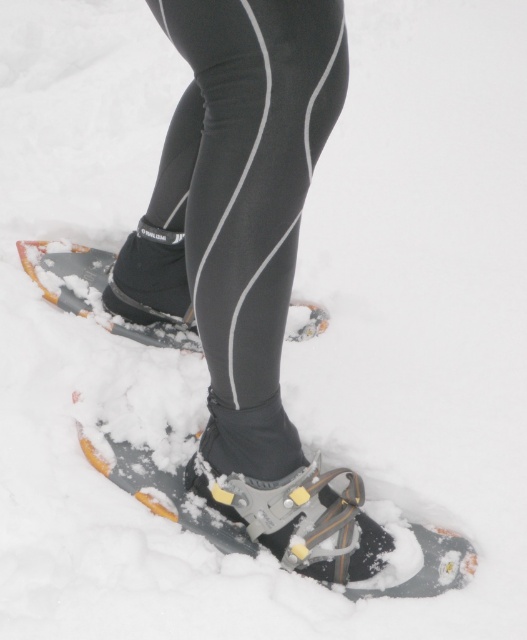
You are planning to place a 5 inch long object between the metallic gray ski boot at lower center and the gray rubber snowshoe at lower center. Based on the scene description, will the object fit in the space between them?

The distance between the metallic gray ski boot at lower center and the gray rubber snowshoe at lower center is 6.27 inches. Since the object is 5 inches long, it will fit in the space between them.

You are trying to determine which item has a greater width between the metallic gray ski boot at lower center and the gray rubber snowshoe at lower center. Based on the scene, which one is wider?

The metallic gray ski boot at lower center is wider than the gray rubber snowshoe at lower center according to the description.